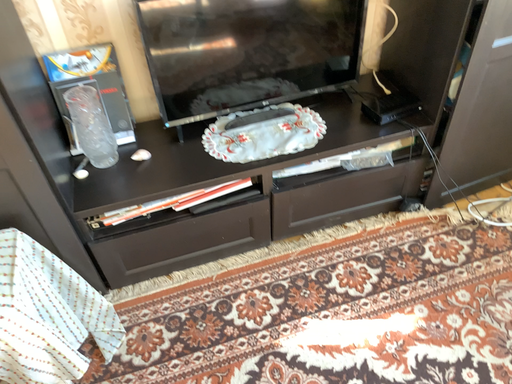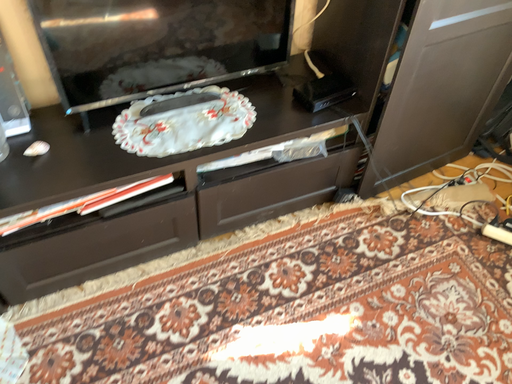
Question: Which way did the camera rotate in the video?

Choices:
 (A) rotated left
 (B) rotated right

Answer: (B)